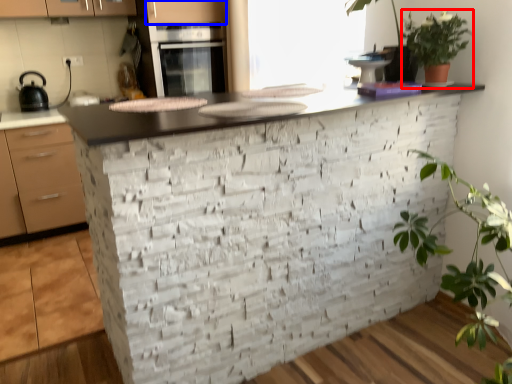
Question: Which of the following is the farthest to the observer, vegetation (highlighted by a red box) or cabinetry (highlighted by a blue box)?

Choices:
 (A) vegetation
 (B) cabinetry

Answer: (B)